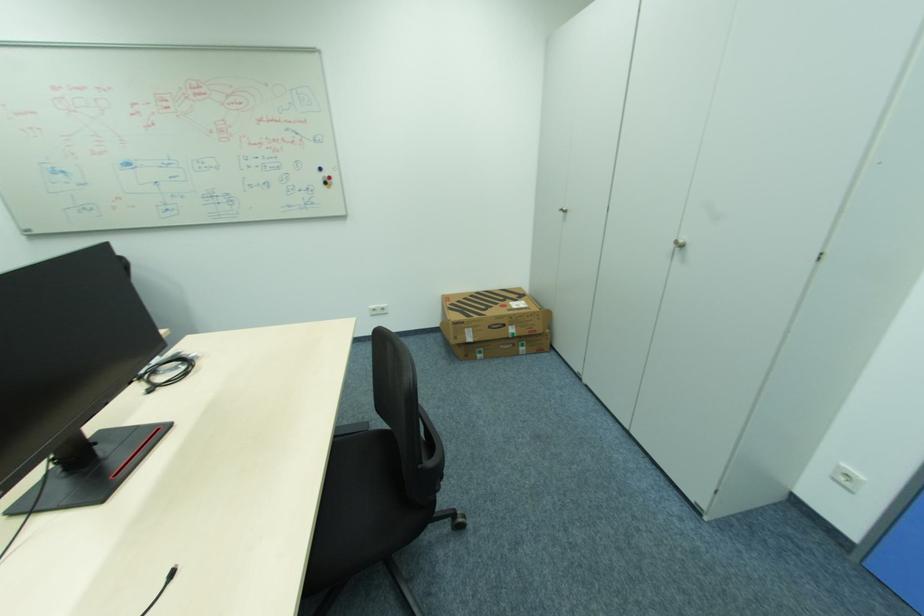
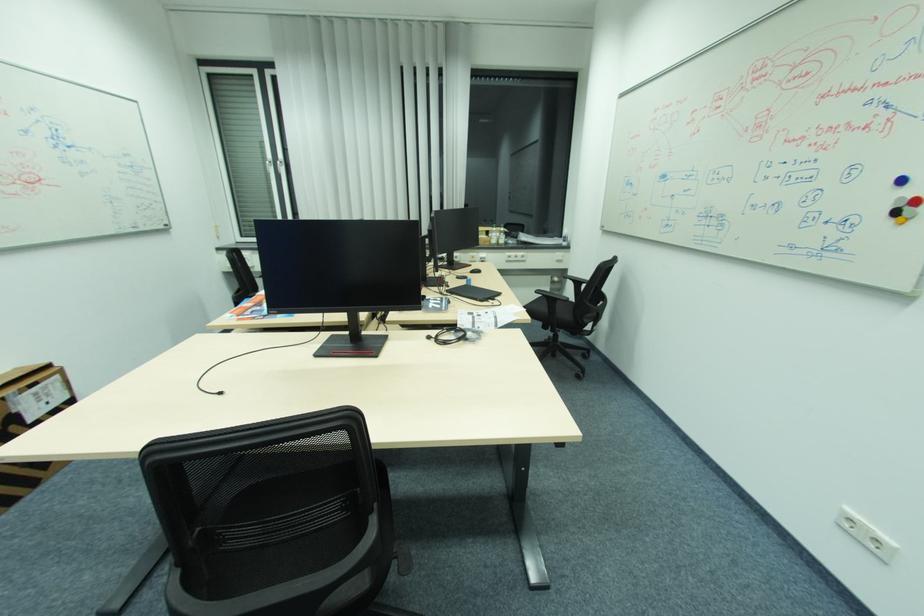
Locate, in the second image, the point that corresponds to point 330,187 in the first image.

(896, 221)